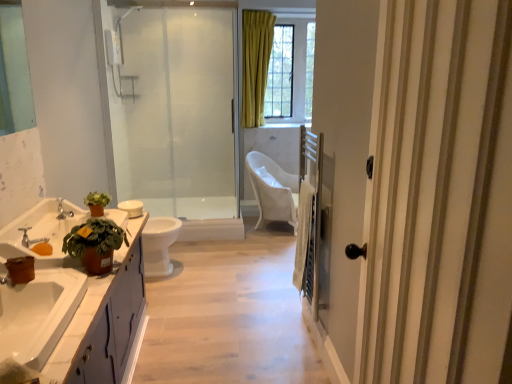
Question: Is woven white chair at center located outside white glossy toilet bowl at center?

Choices:
 (A) no
 (B) yes

Answer: (B)

Question: Can you confirm if woven white chair at center is wider than white glossy toilet bowl at center?

Choices:
 (A) no
 (B) yes

Answer: (B)

Question: From the image's perspective, is woven white chair at center located above white glossy toilet bowl at center?

Choices:
 (A) no
 (B) yes

Answer: (B)

Question: Are woven white chair at center and white glossy toilet bowl at center beside each other?

Choices:
 (A) yes
 (B) no

Answer: (B)

Question: Is white glossy toilet bowl at center located within woven white chair at center?

Choices:
 (A) no
 (B) yes

Answer: (A)

Question: Considering the positions of point (371, 41) and point (22, 228), is point (371, 41) closer or farther from the camera than point (22, 228)?

Choices:
 (A) closer
 (B) farther

Answer: (A)

Question: From the image's perspective, relative to silver metallic faucet at lower left, the 2th tap in the top-to-bottom sequence, is white wood door at right above or below?

Choices:
 (A) above
 (B) below

Answer: (A)

Question: Is white wood door at right bigger or smaller than silver metallic faucet at lower left, the 1th tap from the front?

Choices:
 (A) small
 (B) big

Answer: (B)

Question: Is white wood door at right inside or outside of silver metallic faucet at lower left, marked as the first tap in a bottom-to-top arrangement?

Choices:
 (A) inside
 (B) outside

Answer: (B)

Question: In the image, is white glossy toilet at center on the left side or the right side of white wood door at right?

Choices:
 (A) left
 (B) right

Answer: (A)

Question: Is white glossy toilet at center inside or outside of white wood door at right?

Choices:
 (A) inside
 (B) outside

Answer: (B)

Question: In terms of height, does white glossy toilet at center look taller or shorter compared to white wood door at right?

Choices:
 (A) tall
 (B) short

Answer: (B)

Question: From a real-world perspective, relative to white wood door at right, is white glossy toilet at center vertically above or below?

Choices:
 (A) below
 (B) above

Answer: (A)

Question: From a real-world perspective, is white glossy toilet bowl at center physically located above or below wooden balustrade at right?

Choices:
 (A) below
 (B) above

Answer: (B)

Question: Considering the relative positions of white glossy toilet bowl at center and wooden balustrade at right in the image provided, is white glossy toilet bowl at center to the left or to the right of wooden balustrade at right?

Choices:
 (A) right
 (B) left

Answer: (B)